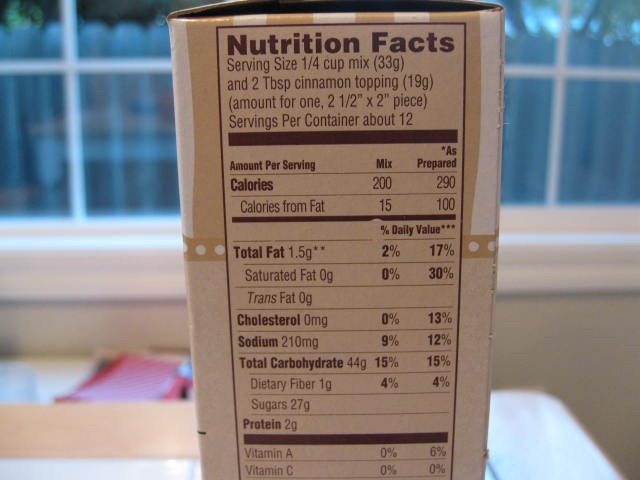
I want to click on windows, so click(116, 118), click(588, 118).